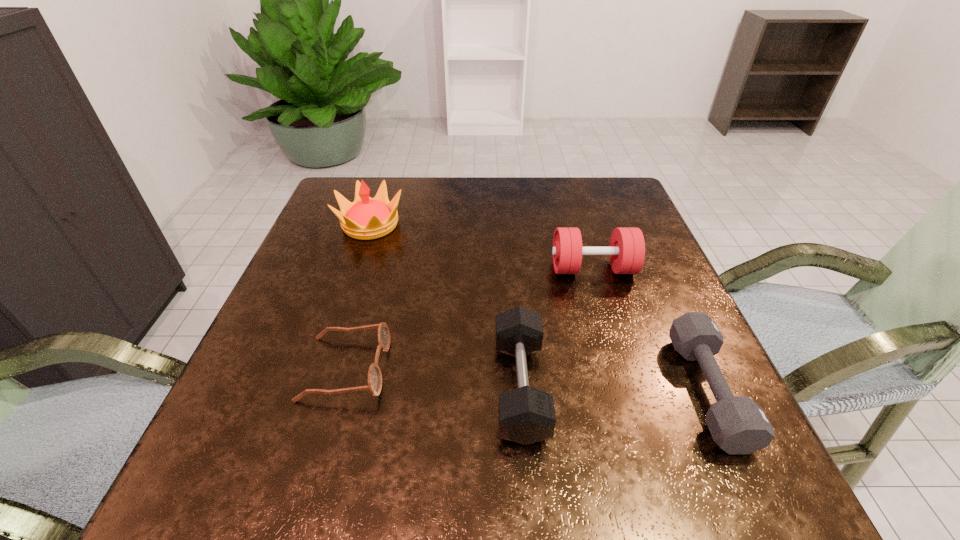
You are a GUI agent. You are given a task and a screenshot of the screen. Output one action in this format:
    pyautogui.click(x=<x>, y=<y>)
    Task: Click on the empty space that is in between the spectacles and the tallest object
    This screenshot has width=960, height=540.
    Given the screenshot: What is the action you would take?
    pyautogui.click(x=358, y=296)

Image resolution: width=960 pixels, height=540 pixels. I want to click on object that is the second closest to the leftmost dumbbell, so click(x=374, y=385).

Point out which object is positioned as the second nearest to the farthest dumbbell. Please provide its 2D coordinates. Your answer should be formatted as a tuple, i.e. [(x, y)], where the tuple contains the x and y coordinates of a point satisfying the conditions above.

[(526, 415)]

I want to click on dumbbell that is the closest one to the fourth tallest object, so click(x=626, y=251).

Locate an element on the screen. Image resolution: width=960 pixels, height=540 pixels. dumbbell that is the second nearest to the leftmost dumbbell is located at coordinates (738, 425).

The image size is (960, 540). In order to click on free spot that satisfies the following two spatial constraints: 1. on the front-facing side of the shortest dumbbell; 2. on the left side of the spectacles in this screenshot , I will do `click(339, 391)`.

Locate an element on the screen. The width and height of the screenshot is (960, 540). free space that satisfies the following two spatial constraints: 1. on the front-facing side of the third object from right to left; 2. on the right side of the spectacles is located at coordinates (340, 388).

What are the coordinates of `free space that satisfies the following two spatial constraints: 1. on the front-facing side of the shortest object; 2. on the back side of the third object from right to left` in the screenshot? It's located at (340, 388).

Where is `vacant area that satisfies the following two spatial constraints: 1. on the front-facing side of the shortest object; 2. on the left side of the second shortest object`? vacant area that satisfies the following two spatial constraints: 1. on the front-facing side of the shortest object; 2. on the left side of the second shortest object is located at coordinates (339, 391).

Locate an element on the screen. This screenshot has width=960, height=540. vacant position in the image that satisfies the following two spatial constraints: 1. on the back side of the farthest dumbbell; 2. on the left side of the third object from left to right is located at coordinates (511, 269).